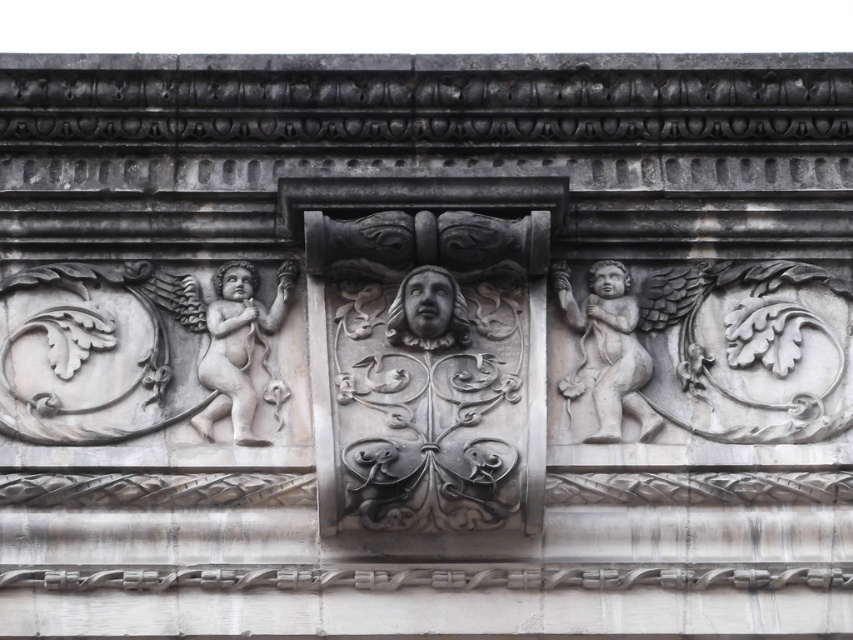
What is the location of the point at coordinates (606, 349) in the image?

The point at coordinates (606, 349) is located on the white stone cherub at center.

You are an architect examining the facade and need to determine the vertical positioning of the white stone cherub at left and the white stone cherub at center. Which one is positioned lower?

The white stone cherub at left is located below the white stone cherub at center, so the one at left is lower.

You are an architect examining the facade and need to determine the spatial arrangement of the sculptures. Which object is positioned to the left of the other between the white stone cherub at left and the gray stone face at center?

The white stone cherub at left is positioned to the left of the gray stone face at center according to the description.